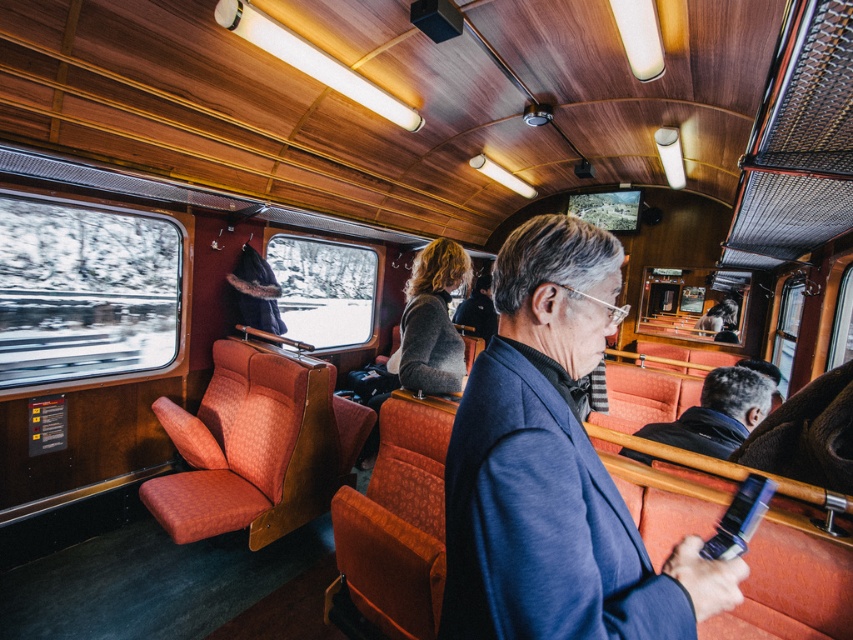
Which is below, blue fabric coach at center or dark gray sweater at center?

blue fabric coach at center is lower down.

What do you see at coordinates (554, 468) in the screenshot? I see `blue fabric coach at center` at bounding box center [554, 468].

The height and width of the screenshot is (640, 853). I want to click on blue fabric coach at center, so click(x=554, y=468).

Is blue fabric coach at center to the right of dark blue jacket at center from the viewer's perspective?

In fact, blue fabric coach at center is to the left of dark blue jacket at center.

Is blue fabric coach at center taller than dark blue jacket at center?

Yes, blue fabric coach at center is taller than dark blue jacket at center.

Which is behind, point (566, 492) or point (718, 440)?

Point (718, 440)

Identify the location of blue fabric coach at center. The image size is (853, 640). point(554,468).

Between dark gray sweater at center and dark blue jacket at center, which one has less height?

Standing shorter between the two is dark blue jacket at center.

Does dark gray sweater at center come in front of dark blue jacket at center?

No.

Which is in front, point (372, 449) or point (764, 380)?

Positioned in front is point (764, 380).

This screenshot has height=640, width=853. I want to click on dark gray sweater at center, so click(x=432, y=321).